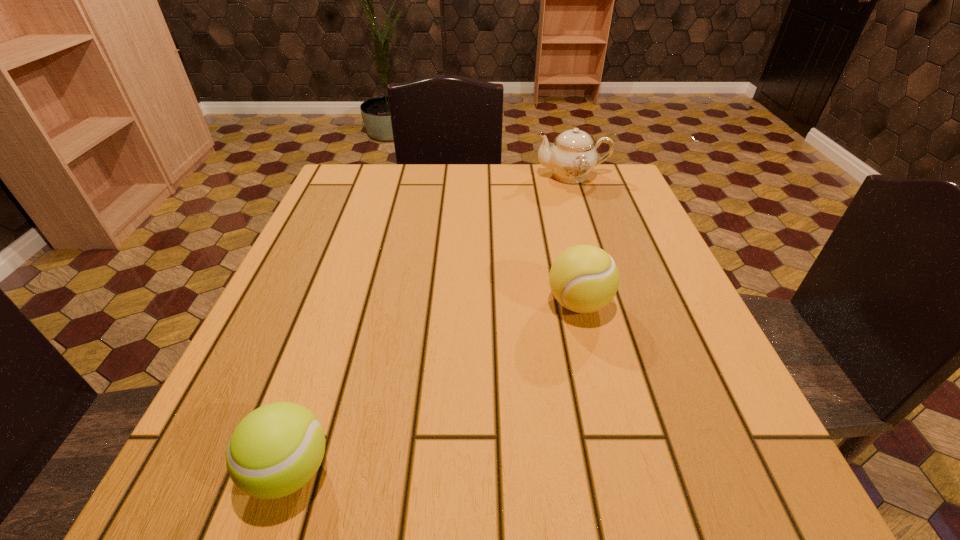
In the image, there is a desktop. What are the coordinates of `free space at the right edge` in the screenshot? It's located at (727, 374).

In the image, there is a desktop. Identify the location of vacant space at the far left corner. This screenshot has height=540, width=960. (378, 204).

This screenshot has height=540, width=960. What are the coordinates of `vacant region at the near left corner of the desktop` in the screenshot? It's located at (207, 454).

You are a GUI agent. You are given a task and a screenshot of the screen. Output one action in this format:
    pyautogui.click(x=<x>, y=<y>)
    Task: Click on the vacant space at the near right corner
    This screenshot has height=540, width=960.
    Given the screenshot: What is the action you would take?
    pyautogui.click(x=686, y=467)

Image resolution: width=960 pixels, height=540 pixels. Identify the location of free space that is in between the leftmost object and the right tennis ball. (434, 387).

Locate an element on the screen. The width and height of the screenshot is (960, 540). vacant space that is in between the second nearest object and the chinaware is located at coordinates (575, 239).

Locate an element on the screen. Image resolution: width=960 pixels, height=540 pixels. empty space that is in between the nearest object and the farther tennis ball is located at coordinates (434, 387).

Identify the location of blank region between the farthest object and the second nearest object. The image size is (960, 540). (575, 239).

Where is `unoccupied area between the farthest object and the second nearest object`? The width and height of the screenshot is (960, 540). unoccupied area between the farthest object and the second nearest object is located at coordinates (575, 239).

Locate an element on the screen. Image resolution: width=960 pixels, height=540 pixels. free point between the farthest object and the farther tennis ball is located at coordinates (575, 239).